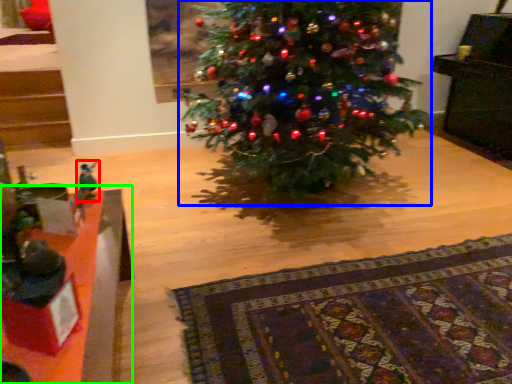
Question: Based on their relative distances, which object is nearer to toy (highlighted by a red box)? Choose from christmas tree (highlighted by a blue box) and table (highlighted by a green box).

Choices:
 (A) christmas tree
 (B) table

Answer: (B)